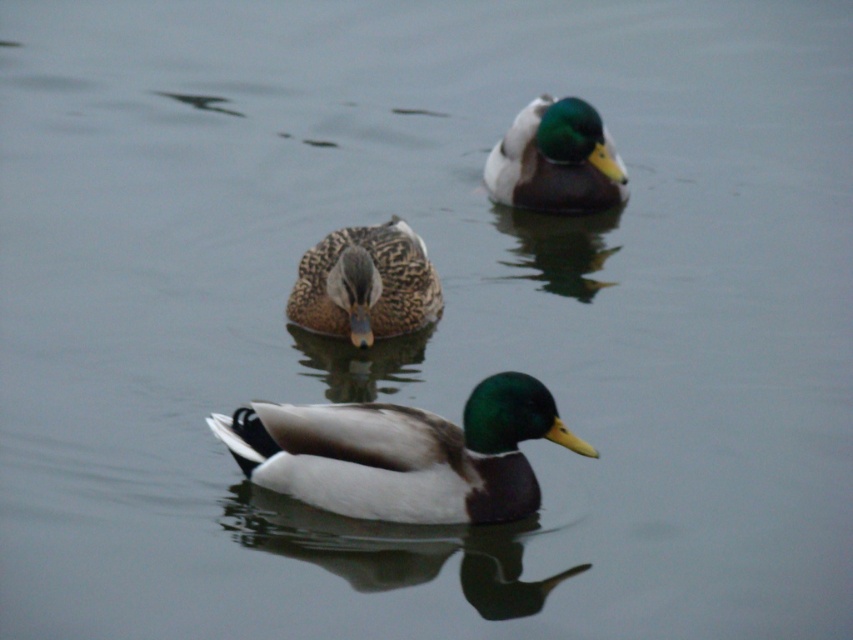
Question: Which of the following is the farthest from the observer?

Choices:
 (A) 329,262
 (B) 584,448
 (C) 544,113

Answer: (C)

Question: Is shiny white duck at center bigger than speckled feather duck at center?

Choices:
 (A) no
 (B) yes

Answer: (B)

Question: Does speckled feather duck at center appear on the right side of green glossy duck at upper center?

Choices:
 (A) no
 (B) yes

Answer: (A)

Question: Among these objects, which one is farthest from the camera?

Choices:
 (A) green glossy duck at upper center
 (B) shiny white duck at center

Answer: (A)

Question: Which object is closer to the camera taking this photo?

Choices:
 (A) shiny white duck at center
 (B) speckled feather duck at center
 (C) green glossy duck at upper center

Answer: (A)

Question: Does shiny white duck at center have a larger size compared to green glossy duck at upper center?

Choices:
 (A) no
 (B) yes

Answer: (A)